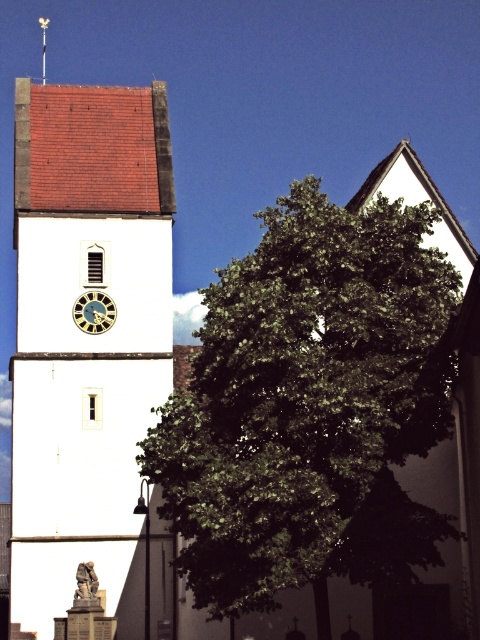
You are standing in front of the white smooth tower at center and the metallic spire at upper center. Which object is closer to you?

The white smooth tower at center is closer to you because it is in front of the metallic spire at upper center.

You are a drone operator who needs to fly a drone from the gold metallic clock at center to the metallic spire at upper center. The drone has a maximum flight distance of 300 feet. Based on the scene, will the drone be able to reach the spire without needing to recharge?

The gold metallic clock at center and metallic spire at upper center are 362.36 feet apart. Since the drone can only fly 300 feet before needing to recharge, it will not be able to reach the spire without recharging.

You are an architect examining the church structure. You notice the white smooth tower at center and the metallic spire at upper center. Which of these two structures is larger in size?

The white smooth tower at center is bigger than the metallic spire at upper center according to the description.